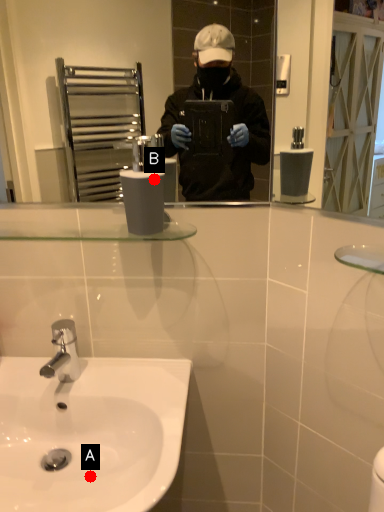
Question: Two points are circled on the image, labeled by A and B beside each circle. Which point is closer to the camera?

Choices:
 (A) A is closer
 (B) B is closer

Answer: (B)